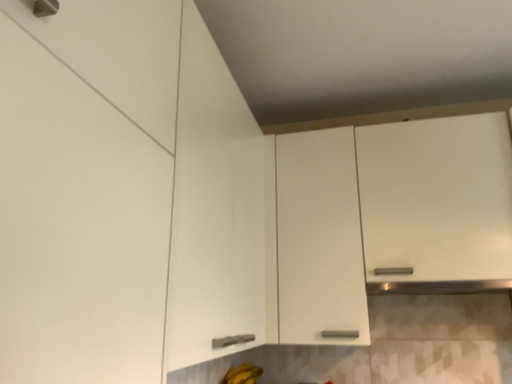
Question: Is yellow matte bananas at lower center wider or thinner than white matte cabinet at lower left, the 1th cabinetry when ordered from left to right?

Choices:
 (A) wide
 (B) thin

Answer: (B)

Question: Do you think yellow matte bananas at lower center is within white matte cabinet at lower left, the second cabinetry in the right-to-left sequence, or outside of it?

Choices:
 (A) inside
 (B) outside

Answer: (B)

Question: Which is farther from the white matte cabinet at lower left, the 1th cabinetry when ordered from left to right?

Choices:
 (A) white matte cabinet at upper right, acting as the 2th cabinetry starting from the left
 (B) yellow matte bananas at lower center

Answer: (B)

Question: Which object is positioned farthest from the yellow matte bananas at lower center?

Choices:
 (A) white matte cabinet at lower left, the 1th cabinetry when ordered from left to right
 (B) white matte cabinet at upper right, placed as the 1th cabinetry when sorted from right to left

Answer: (A)